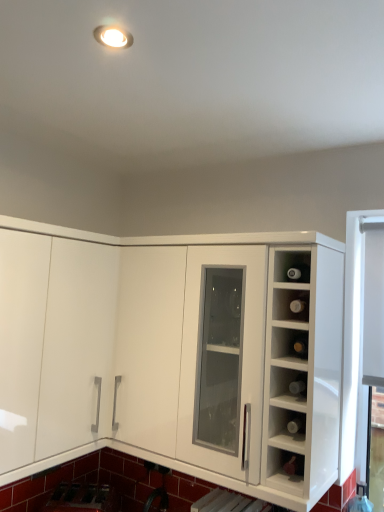
Question: Is white glossy cabinet at center inside metallic silver sink at lower left?

Choices:
 (A) no
 (B) yes

Answer: (A)

Question: Would you consider metallic silver sink at lower left to be distant from white glossy cabinet at center?

Choices:
 (A) no
 (B) yes

Answer: (A)

Question: Is metallic silver sink at lower left looking in the opposite direction of white glossy cabinet at center?

Choices:
 (A) no
 (B) yes

Answer: (A)

Question: Is metallic silver sink at lower left smaller than white glossy cabinet at center?

Choices:
 (A) yes
 (B) no

Answer: (A)

Question: From the image's perspective, is metallic silver sink at lower left located above white glossy cabinet at center?

Choices:
 (A) no
 (B) yes

Answer: (A)

Question: Considering the relative sizes of metallic silver sink at lower left and white glossy cabinet at center in the image provided, is metallic silver sink at lower left thinner than white glossy cabinet at center?

Choices:
 (A) no
 (B) yes

Answer: (B)

Question: From the image's perspective, is metallic silver sink at lower left above transparent glass bottles at right?

Choices:
 (A) yes
 (B) no

Answer: (B)

Question: Considering the relative positions of metallic silver sink at lower left and transparent glass bottles at right in the image provided, is metallic silver sink at lower left to the left of transparent glass bottles at right from the viewer's perspective?

Choices:
 (A) no
 (B) yes

Answer: (B)

Question: Are metallic silver sink at lower left and transparent glass bottles at right beside each other?

Choices:
 (A) yes
 (B) no

Answer: (B)

Question: Is the position of metallic silver sink at lower left less distant than that of transparent glass bottles at right?

Choices:
 (A) yes
 (B) no

Answer: (B)

Question: Can you confirm if metallic silver sink at lower left is smaller than transparent glass bottles at right?

Choices:
 (A) yes
 (B) no

Answer: (B)

Question: Is metallic silver sink at lower left taller than transparent glass bottles at right?

Choices:
 (A) no
 (B) yes

Answer: (B)

Question: Does metallic silver sink at lower left have a lesser height compared to matte glass wine bottle at upper right?

Choices:
 (A) no
 (B) yes

Answer: (A)